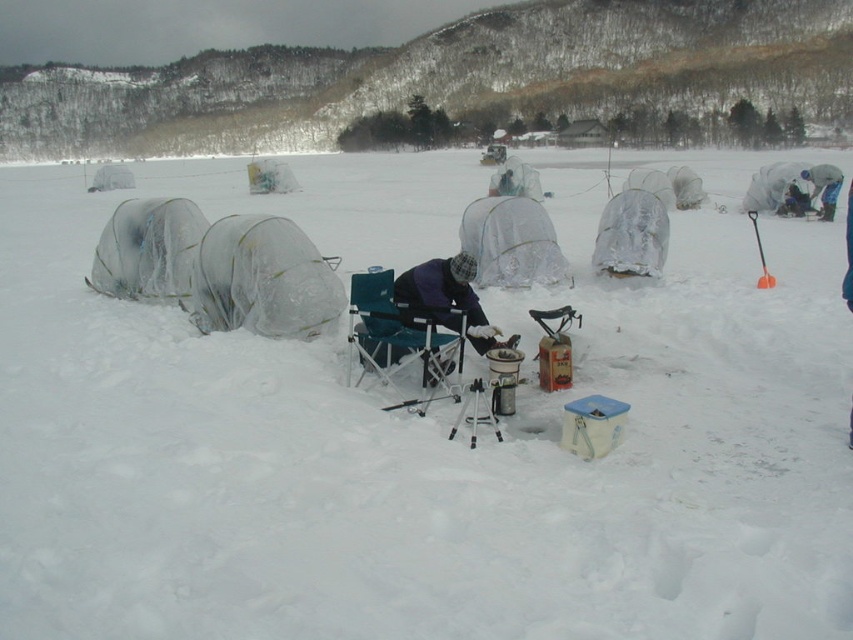
Question: Which point is farther to the camera?

Choices:
 (A) (815, 173)
 (B) (763, 260)
 (C) (189, 237)

Answer: (A)

Question: Which point appears closest to the camera in this image?

Choices:
 (A) (756, 221)
 (B) (126, 184)
 (C) (526, 220)
 (D) (393, 285)

Answer: (D)

Question: Is dark blue fabric jacket at center to the right of transparent plastic tent at upper left from the viewer's perspective?

Choices:
 (A) yes
 (B) no

Answer: (A)

Question: Can you confirm if teal fabric folding chair at center is positioned below blue fabric jacket at upper right?

Choices:
 (A) no
 (B) yes

Answer: (B)

Question: Estimate the real-world distances between objects in this image. Which object is farther from the transparent plastic tent at upper left?

Choices:
 (A) teal fabric folding chair at center
 (B) clear plastic tent at center

Answer: (A)

Question: From the image, what is the correct spatial relationship of clear plastic tent at center in relation to metallic tripod at center?

Choices:
 (A) below
 (B) above

Answer: (B)